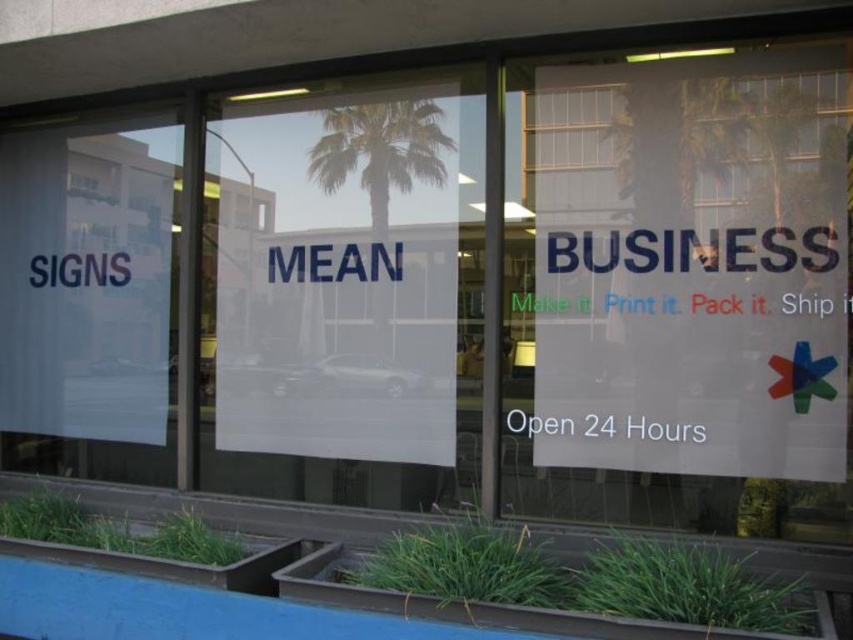
In the scene shown: Is transparent paper sign at left further to the viewer compared to green leafy palm tree at center?

Yes, transparent paper sign at left is behind green leafy palm tree at center.

Between transparent paper sign at left and green leafy palm tree at center, which one appears on the left side from the viewer's perspective?

transparent paper sign at left is more to the left.

The height and width of the screenshot is (640, 853). I want to click on transparent paper sign at left, so click(x=90, y=298).